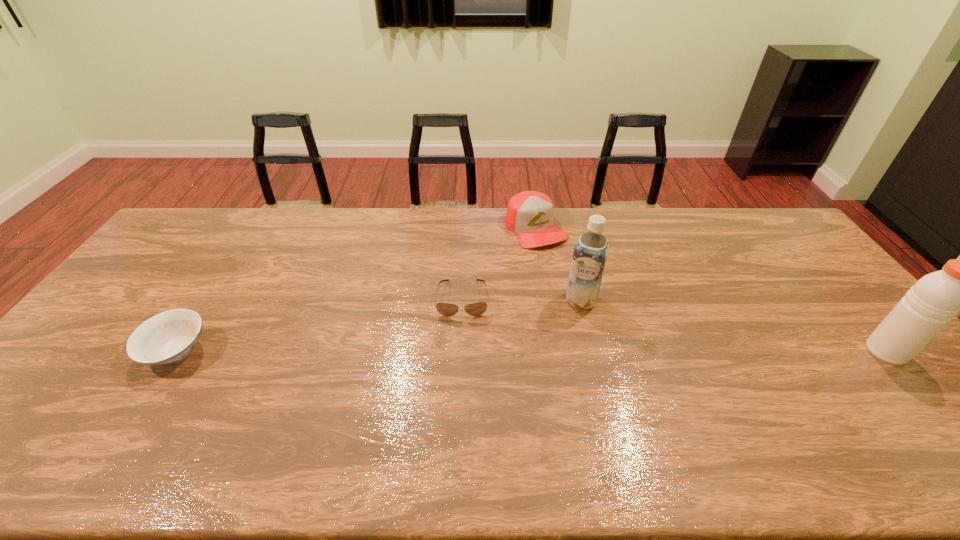
The width and height of the screenshot is (960, 540). Identify the location of vacant region located on the front-facing side of the third tallest object. (579, 284).

The width and height of the screenshot is (960, 540). I want to click on vacant space located on the front-facing side of the third tallest object, so click(x=576, y=280).

Locate an element on the screen. vacant region located on the front-facing side of the third tallest object is located at coordinates (566, 268).

Identify the location of vacant space located on the label of the soya milk. This screenshot has width=960, height=540. (564, 351).

The image size is (960, 540). In order to click on vacant space situated 0.330m on the label of the soya milk in this screenshot , I will do `click(547, 402)`.

At what (x,y) coordinates should I click in order to perform the action: click on vacant space located 0.120m on the label of the soya milk. Please return your answer as a coordinate pair (x, y). Image resolution: width=960 pixels, height=540 pixels. Looking at the image, I should click on (567, 340).

Where is `vacant area located on the front-facing side of the fourth object from right to left`? The image size is (960, 540). vacant area located on the front-facing side of the fourth object from right to left is located at coordinates (462, 346).

Identify the location of free space located on the front-facing side of the fourth object from right to left. (461, 404).

The image size is (960, 540). What are the coordinates of `free location located on the front-facing side of the fourth object from right to left` in the screenshot? It's located at (462, 340).

This screenshot has height=540, width=960. In order to click on object present at the far edge in this screenshot , I will do `click(530, 214)`.